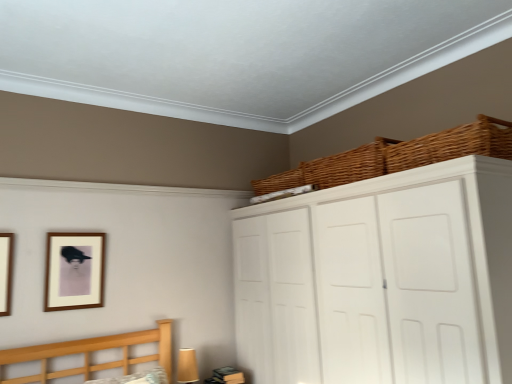
Question: Does matte brown picture frame at upper left, arranged as the second picture frame when viewed from the front, have a larger size compared to white matte cupboard at upper right?

Choices:
 (A) yes
 (B) no

Answer: (B)

Question: Is matte brown picture frame at upper left, arranged as the 1th picture frame when viewed from the back, far away from white matte cupboard at upper right?

Choices:
 (A) no
 (B) yes

Answer: (B)

Question: Can you confirm if matte brown picture frame at upper left, arranged as the second picture frame when viewed from the front, is thinner than white matte cupboard at upper right?

Choices:
 (A) yes
 (B) no

Answer: (A)

Question: Is white matte cupboard at upper right surrounded by matte brown picture frame at upper left, arranged as the 1th picture frame when viewed from the back?

Choices:
 (A) yes
 (B) no

Answer: (B)

Question: Is matte brown picture frame at upper left, which is the 1th picture frame in right-to-left order, to the left of white matte cupboard at upper right from the viewer's perspective?

Choices:
 (A) no
 (B) yes

Answer: (B)

Question: From a real-world perspective, is woven brown basket at upper right, arranged as the third basket when viewed from the back, above or below wooden picture frame at left, which appears as the 2th picture frame when viewed from the right?

Choices:
 (A) above
 (B) below

Answer: (A)

Question: Considering the positions of woven brown basket at upper right, which is counted as the first basket, starting from the front, and wooden picture frame at left, marked as the first picture frame in a left-to-right arrangement, in the image, is woven brown basket at upper right, which is counted as the first basket, starting from the front, bigger or smaller than wooden picture frame at left, marked as the first picture frame in a left-to-right arrangement,?

Choices:
 (A) small
 (B) big

Answer: (B)

Question: Choose the correct answer: Is woven brown basket at upper right, arranged as the third basket when viewed from the back, inside wooden picture frame at left, marked as the first picture frame in a left-to-right arrangement, or outside it?

Choices:
 (A) inside
 (B) outside

Answer: (B)

Question: Considering the positions of point (449, 144) and point (5, 314), is point (449, 144) closer or farther from the camera than point (5, 314)?

Choices:
 (A) closer
 (B) farther

Answer: (A)

Question: From a real-world perspective, is matte brown picture frame at upper left, which is the 1th picture frame in right-to-left order, physically located above or below woven brown basket at upper center, which is the second basket from front to back?

Choices:
 (A) above
 (B) below

Answer: (B)

Question: In terms of width, does matte brown picture frame at upper left, arranged as the 1th picture frame when viewed from the back, look wider or thinner when compared to woven brown basket at upper center, the 2th basket viewed from the back?

Choices:
 (A) thin
 (B) wide

Answer: (A)

Question: Considering the positions of matte brown picture frame at upper left, arranged as the second picture frame when viewed from the front, and woven brown basket at upper center, which is the second basket from front to back, in the image, is matte brown picture frame at upper left, arranged as the second picture frame when viewed from the front, taller or shorter than woven brown basket at upper center, which is the second basket from front to back,?

Choices:
 (A) tall
 (B) short

Answer: (A)

Question: Considering the positions of point (66, 286) and point (317, 183), is point (66, 286) closer or farther from the camera than point (317, 183)?

Choices:
 (A) farther
 (B) closer

Answer: (A)

Question: Looking at their shapes, would you say white matte cupboard at upper right is wider or thinner than wooden picture frame at left, marked as the first picture frame in a left-to-right arrangement?

Choices:
 (A) thin
 (B) wide

Answer: (B)

Question: Considering the relative positions of white matte cupboard at upper right and wooden picture frame at left, the first picture frame from the front, in the image provided, is white matte cupboard at upper right to the left or to the right of wooden picture frame at left, the first picture frame from the front,?

Choices:
 (A) left
 (B) right

Answer: (B)